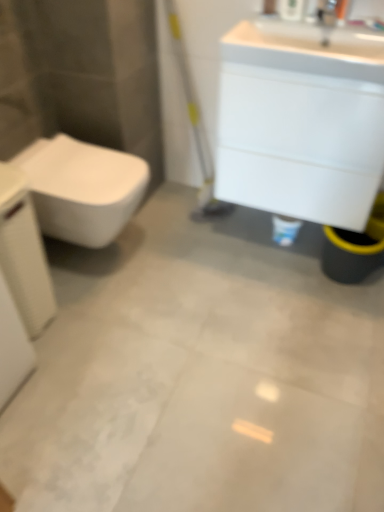
Question: Considering the relative sizes of white glossy cabinet at upper right and white glossy toilet at left in the image provided, is white glossy cabinet at upper right wider than white glossy toilet at left?

Choices:
 (A) no
 (B) yes

Answer: (A)

Question: Is white glossy cabinet at upper right touching white glossy toilet at left?

Choices:
 (A) yes
 (B) no

Answer: (B)

Question: Can you confirm if white glossy cabinet at upper right is positioned to the left of white glossy toilet at left?

Choices:
 (A) no
 (B) yes

Answer: (A)

Question: From the image's perspective, is white glossy cabinet at upper right on top of white glossy toilet at left?

Choices:
 (A) no
 (B) yes

Answer: (B)

Question: From a real-world perspective, is white glossy cabinet at upper right below white glossy toilet at left?

Choices:
 (A) yes
 (B) no

Answer: (B)

Question: Based on their sizes in the image, would you say white glossy sink at upper right is bigger or smaller than white glossy toilet at left?

Choices:
 (A) big
 (B) small

Answer: (B)

Question: In the image, is white glossy sink at upper right positioned in front of or behind white glossy toilet at left?

Choices:
 (A) behind
 (B) front

Answer: (B)

Question: Is white glossy sink at upper right spatially inside white glossy toilet at left, or outside of it?

Choices:
 (A) inside
 (B) outside

Answer: (B)

Question: Is white glossy sink at upper right to the left or to the right of white glossy toilet at left in the image?

Choices:
 (A) left
 (B) right

Answer: (B)

Question: Is point (319, 8) positioned closer to the camera than point (377, 39)?

Choices:
 (A) closer
 (B) farther

Answer: (B)

Question: In terms of width, does silver metallic faucet at upper right look wider or thinner when compared to white glossy sink at upper right?

Choices:
 (A) thin
 (B) wide

Answer: (A)

Question: In the image, is silver metallic faucet at upper right positioned in front of or behind white glossy sink at upper right?

Choices:
 (A) behind
 (B) front

Answer: (A)

Question: From a real-world perspective, is silver metallic faucet at upper right physically located above or below white glossy sink at upper right?

Choices:
 (A) above
 (B) below

Answer: (A)

Question: Looking at their shapes, would you say white glossy cabinet at upper right is wider or thinner than white textured porcelain at left?

Choices:
 (A) thin
 (B) wide

Answer: (B)

Question: Considering the positions of white glossy cabinet at upper right and white textured porcelain at left in the image, is white glossy cabinet at upper right bigger or smaller than white textured porcelain at left?

Choices:
 (A) big
 (B) small

Answer: (A)